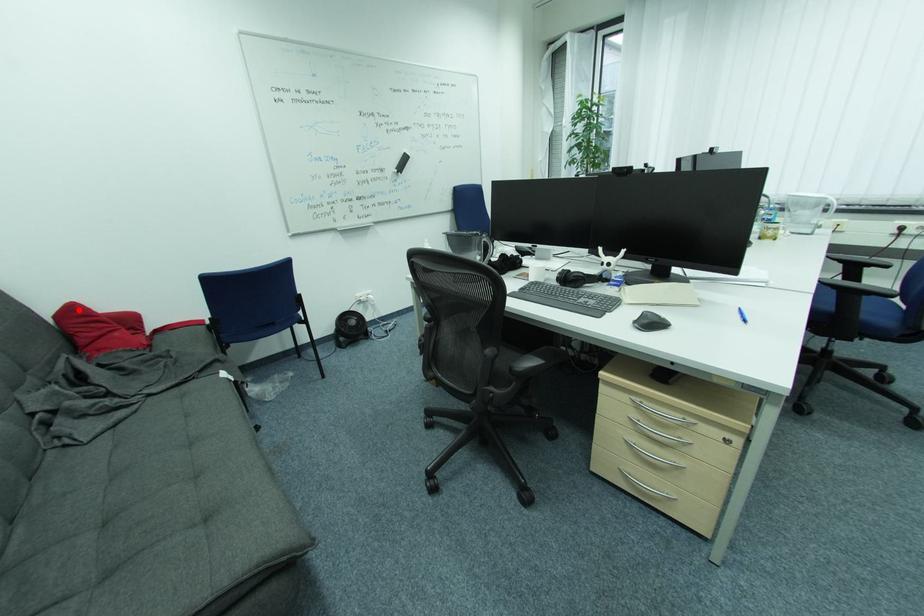
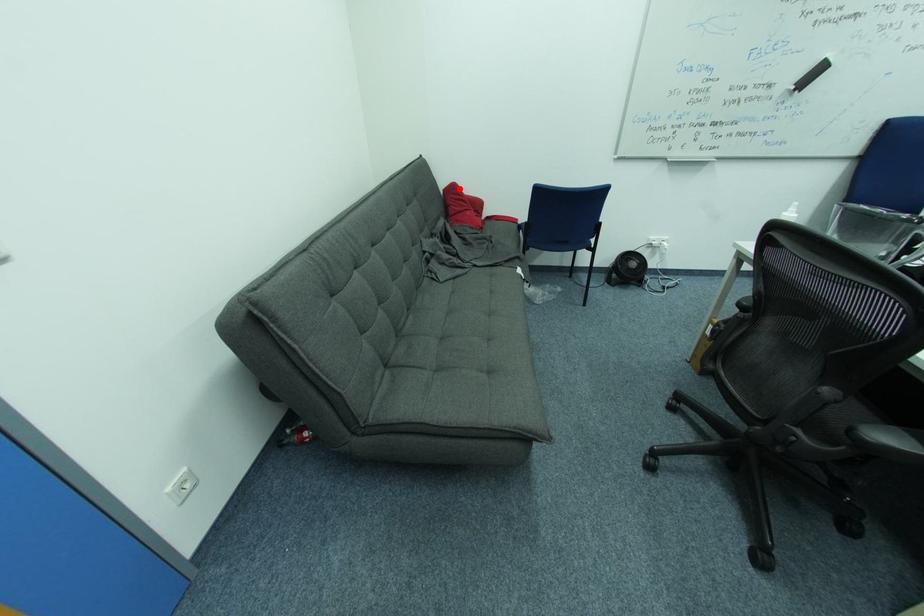
I am providing you with two images of the same scene from different viewpoints. A red point is marked on the first image and another point is marked on the second image. Does the point marked in image1 correspond to the same location as the one in image2?

Yes